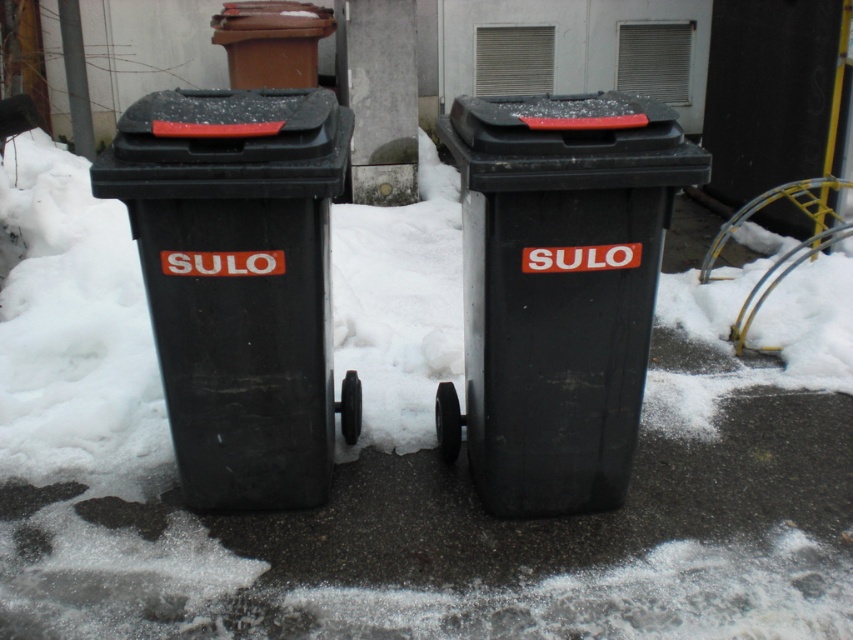
Find the location of a particular element. This screenshot has width=853, height=640. black plastic recycling bin at center is located at coordinates (560, 289).

Can you confirm if black plastic recycling bin at center is positioned to the right of black plastic recycling bin at left?

Correct, you'll find black plastic recycling bin at center to the right of black plastic recycling bin at left.

Does point (566, 301) lie behind point (248, 156)?

Yes, it is behind point (248, 156).

Image resolution: width=853 pixels, height=640 pixels. In order to click on black plastic recycling bin at center in this screenshot , I will do `click(560, 289)`.